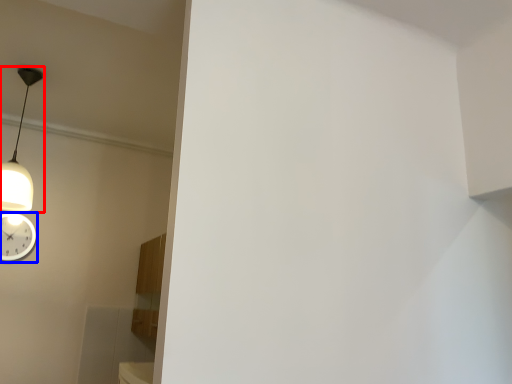
Question: Which point is closer to the camera, lamp (highlighted by a red box) or wall clock (highlighted by a blue box)?

Choices:
 (A) lamp
 (B) wall clock

Answer: (A)